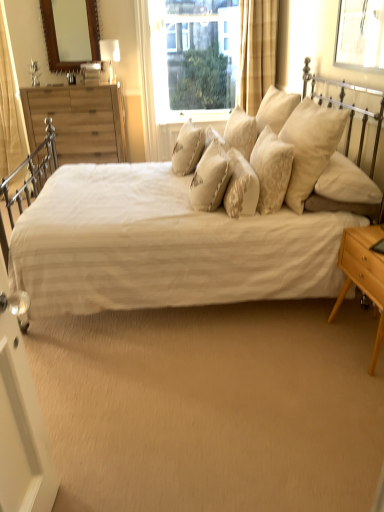
Question: Does white glossy screen door at lower left contain creamy fabric pillow at center, which is the 5th pillow from left to right?

Choices:
 (A) no
 (B) yes

Answer: (A)

Question: From the image's perspective, does white glossy screen door at lower left appear lower than creamy fabric pillow at center, which is the 5th pillow from left to right?

Choices:
 (A) no
 (B) yes

Answer: (B)

Question: Are white glossy screen door at lower left and creamy fabric pillow at center, which is the 5th pillow from left to right, located far from each other?

Choices:
 (A) no
 (B) yes

Answer: (B)

Question: Is white glossy screen door at lower left in contact with creamy fabric pillow at center, which is the 5th pillow from left to right?

Choices:
 (A) no
 (B) yes

Answer: (A)

Question: Is white glossy screen door at lower left at the right side of creamy fabric pillow at center, which is the 5th pillow from left to right?

Choices:
 (A) no
 (B) yes

Answer: (A)

Question: Do you think soft cream fabric pillows at center, positioned as the first pillow in right-to-left order, is within creamy fabric pillow at center, which ranks as the second pillow in right-to-left order, or outside of it?

Choices:
 (A) inside
 (B) outside

Answer: (B)

Question: Based on their sizes in the image, would you say soft cream fabric pillows at center, positioned as the first pillow in right-to-left order, is bigger or smaller than creamy fabric pillow at center, which is the 5th pillow from left to right?

Choices:
 (A) big
 (B) small

Answer: (A)

Question: In terms of height, does soft cream fabric pillows at center, positioned as the first pillow in right-to-left order, look taller or shorter compared to creamy fabric pillow at center, which ranks as the second pillow in right-to-left order?

Choices:
 (A) short
 (B) tall

Answer: (B)

Question: In terms of width, does soft cream fabric pillows at center, positioned as the first pillow in right-to-left order, look wider or thinner when compared to creamy fabric pillow at center, which is the 5th pillow from left to right?

Choices:
 (A) thin
 (B) wide

Answer: (B)

Question: From a real-world perspective, is matte white table lamp at upper center physically located above or below white glossy screen door at lower left?

Choices:
 (A) below
 (B) above

Answer: (B)

Question: Is point (109, 44) closer or farther from the camera than point (46, 442)?

Choices:
 (A) farther
 (B) closer

Answer: (A)

Question: Choose the correct answer: Is matte white table lamp at upper center inside white glossy screen door at lower left or outside it?

Choices:
 (A) outside
 (B) inside

Answer: (A)

Question: Considering the positions of matte white table lamp at upper center and white glossy screen door at lower left in the image, is matte white table lamp at upper center taller or shorter than white glossy screen door at lower left?

Choices:
 (A) short
 (B) tall

Answer: (A)

Question: From the image's perspective, is transparent plastic window screen at upper right positioned above or below beige textured pillow at center, which ranks as the third pillow in left-to-right order?

Choices:
 (A) below
 (B) above

Answer: (B)

Question: Considering the positions of transparent plastic window screen at upper right and beige textured pillow at center, acting as the 4th pillow starting from the right, in the image, is transparent plastic window screen at upper right taller or shorter than beige textured pillow at center, acting as the 4th pillow starting from the right,?

Choices:
 (A) tall
 (B) short

Answer: (A)